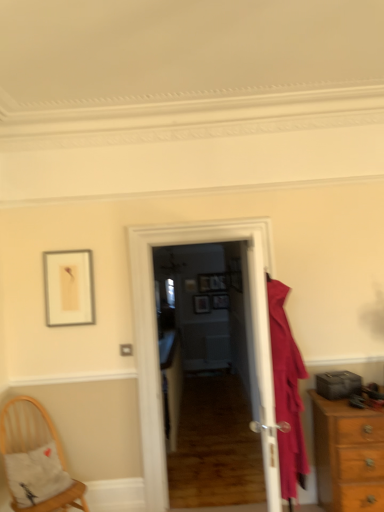
Question: Should I look upward or downward to see wooden picture frame at center, which is the second picture frame from right to left?

Choices:
 (A) up
 (B) down

Answer: (B)

Question: Is matte pink coat at right positioned behind white glossy door at center, positioned as the 2th door in back-to-front order?

Choices:
 (A) no
 (B) yes

Answer: (B)

Question: Is the position of matte pink coat at right less distant than that of white glossy door at center, positioned as the 2th door in back-to-front order?

Choices:
 (A) yes
 (B) no

Answer: (B)

Question: From the image's perspective, is matte pink coat at right below white glossy door at center, the first door from the front?

Choices:
 (A) no
 (B) yes

Answer: (B)

Question: Is matte pink coat at right not near white glossy door at center, positioned as the 2th door in back-to-front order?

Choices:
 (A) no
 (B) yes

Answer: (A)

Question: Can you confirm if matte pink coat at right is wider than white glossy door at center, positioned as the 2th door in back-to-front order?

Choices:
 (A) no
 (B) yes

Answer: (B)

Question: Is white glossy door at center, the first door from the front, completely or partially inside matte pink coat at right?

Choices:
 (A) yes
 (B) no

Answer: (A)

Question: From the image's perspective, is matte gold picture frame at center, arranged as the fourth picture frame when viewed from the right, on top of matte wooden picture frame at center, the second picture frame in the left-to-right sequence?

Choices:
 (A) no
 (B) yes

Answer: (B)

Question: Is matte gold picture frame at center, which is the first picture frame in left-to-right order, with matte wooden picture frame at center, the second picture frame in the left-to-right sequence?

Choices:
 (A) yes
 (B) no

Answer: (B)

Question: Is matte gold picture frame at center, which is the first picture frame in left-to-right order, not inside matte wooden picture frame at center, the second picture frame in the left-to-right sequence?

Choices:
 (A) no
 (B) yes

Answer: (B)

Question: Considering the relative sizes of matte gold picture frame at center, which is the first picture frame in left-to-right order, and matte wooden picture frame at center, the second picture frame in the left-to-right sequence, in the image provided, is matte gold picture frame at center, which is the first picture frame in left-to-right order, bigger than matte wooden picture frame at center, the second picture frame in the left-to-right sequence,?

Choices:
 (A) no
 (B) yes

Answer: (A)

Question: Is matte gold picture frame at center, arranged as the fourth picture frame when viewed from the right, wider than matte wooden picture frame at center, which appears as the 3th picture frame when viewed from the right?

Choices:
 (A) no
 (B) yes

Answer: (A)

Question: Considering the relative positions of matte gold picture frame at center, which is the first picture frame in left-to-right order, and matte wooden picture frame at center, which appears as the 3th picture frame when viewed from the right, in the image provided, is matte gold picture frame at center, which is the first picture frame in left-to-right order, to the left of matte wooden picture frame at center, which appears as the 3th picture frame when viewed from the right, from the viewer's perspective?

Choices:
 (A) yes
 (B) no

Answer: (A)

Question: From a real-world perspective, is matte gold picture frame at center, which is the first picture frame in left-to-right order, positioned over woven wood chair at lower left based on gravity?

Choices:
 (A) no
 (B) yes

Answer: (B)